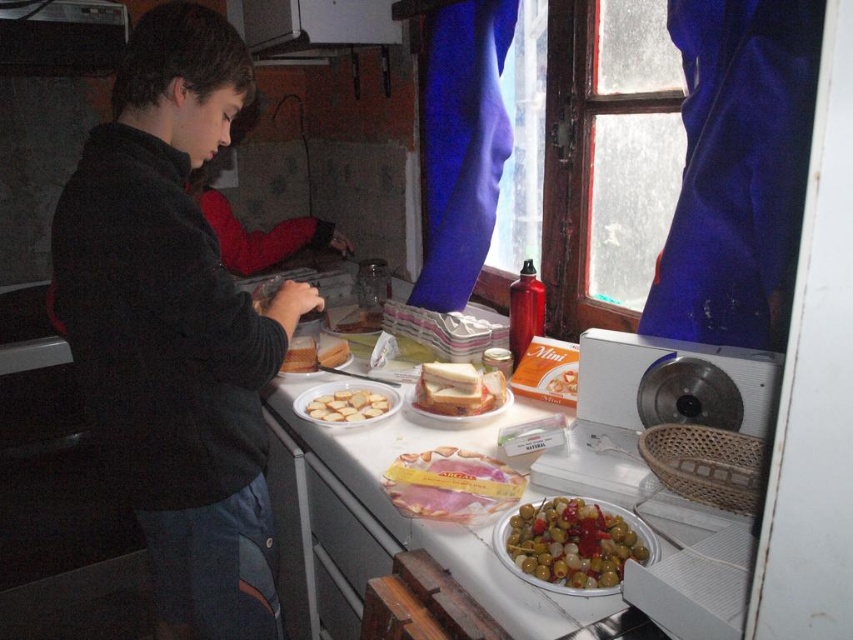
Is green olive tapenade at lower center thinner than golden crumbly crackers at center?

No.

Does point (643, 552) lie behind point (349, 388)?

No.

From the picture: Measure the distance between green olive tapenade at lower center and camera.

green olive tapenade at lower center is 35.73 inches from camera.

Where is `green olive tapenade at lower center`? green olive tapenade at lower center is located at coordinates (573, 544).

Between point (564, 566) and point (500, 412), which one is positioned in front?

Point (564, 566)

Is green olive tapenade at lower center in front of white plastic plate at center?

Yes, green olive tapenade at lower center is in front of white plastic plate at center.

Which is behind, point (608, 548) or point (454, 420)?

Point (454, 420)

Locate an element on the screen. The width and height of the screenshot is (853, 640). green olive tapenade at lower center is located at coordinates (573, 544).

Does golden crumbly crackers at center have a larger size compared to matte white bread at center?

No, golden crumbly crackers at center is not bigger than matte white bread at center.

Which is above, golden crumbly crackers at center or matte white bread at center?

matte white bread at center

Where is `golden crumbly crackers at center`? This screenshot has height=640, width=853. golden crumbly crackers at center is located at coordinates (347, 404).